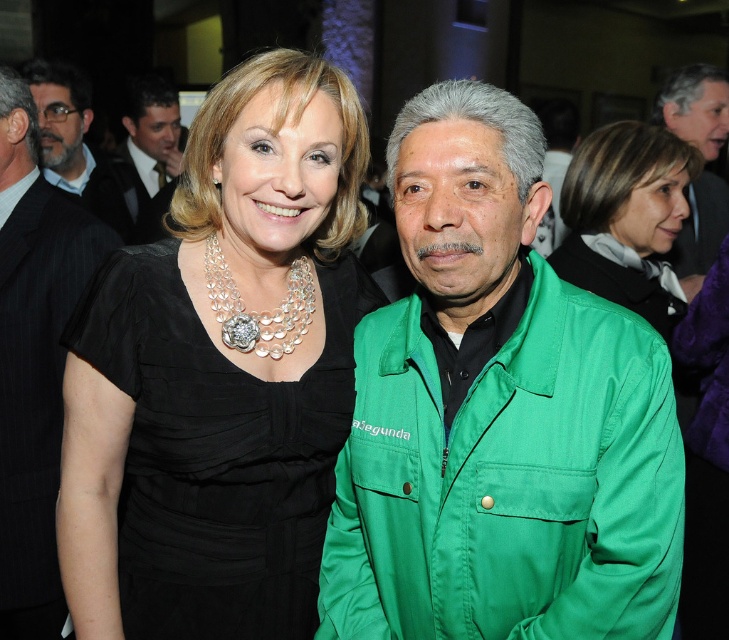
Question: Among these points, which one is nearest to the camera?

Choices:
 (A) (717, 196)
 (B) (230, 554)

Answer: (B)

Question: Which of these objects is positioned farthest from the black satin dress at center?

Choices:
 (A) matte black suit at left
 (B) matte black suit at upper left

Answer: (B)

Question: Is black satin dress at center to the left of black pinstripe suit at center from the viewer's perspective?

Choices:
 (A) yes
 (B) no

Answer: (B)

Question: Does matte green jacket at right have a smaller size compared to matte black suit at upper left?

Choices:
 (A) no
 (B) yes

Answer: (B)

Question: Can you confirm if black pinstripe suit at center is thinner than matte green jacket at right?

Choices:
 (A) yes
 (B) no

Answer: (A)

Question: Which point is closer to the camera?

Choices:
 (A) black pinstripe suit at center
 (B) matte black suit at upper left
 (C) matte black suit at left

Answer: (A)